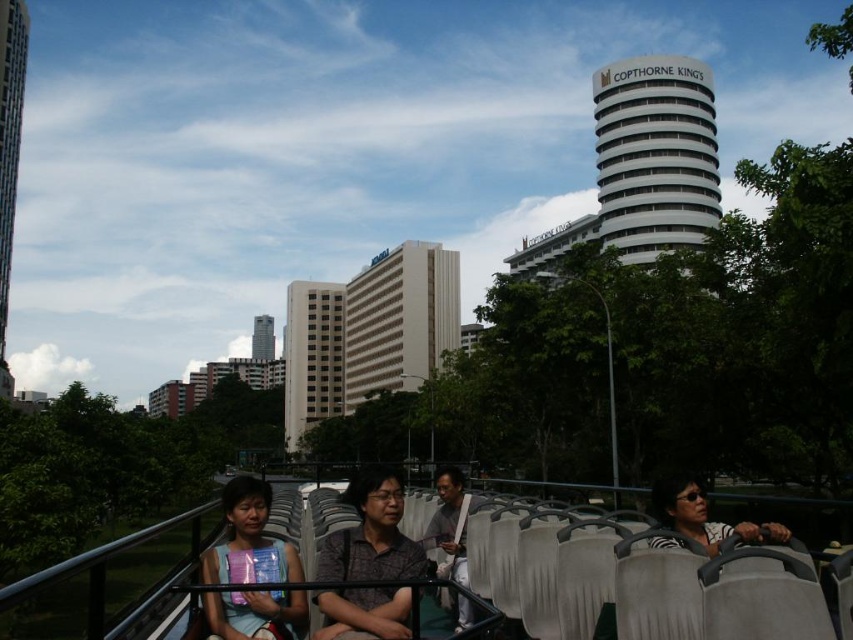
You are a passenger on the open top bus and want to lean forward to take a photo of the Copthorne King building. The dark gray fabric shirt at center is in your way. Can you move past it to reach the black plastic rail at lower center?

The black plastic rail at lower center is located below the dark gray fabric shirt at center, so you can move past the dark gray fabric shirt at center to reach the black plastic rail at lower center.

You are a passenger on the open top bus and you see two points in the distance. The first point is at coordinate point (384,632) and the second point is at coordinate point (270,609). Which point is closer to you?

Point (384,632) is in front of point (270,609), so the first point is closer to you.